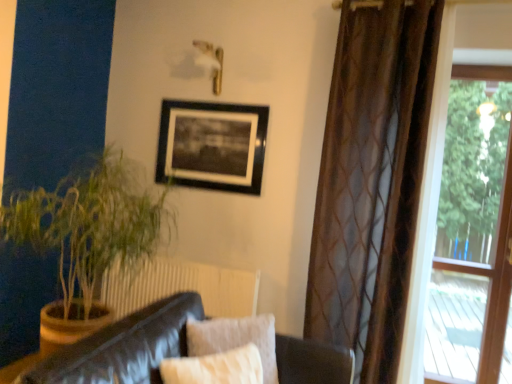
Describe the element at coordinates (212, 145) in the screenshot. I see `black matte picture frame at upper center` at that location.

What is the approximate width of transparent glass window at right?

transparent glass window at right is 2.80 inches wide.

Locate an element on the screen. green leafy plant at left is located at coordinates (89, 224).

At what (x,y) coordinates should I click in order to perform the action: click on leather couch at lower left. Please return your answer as a coordinate pair (x, y). Image resolution: width=512 pixels, height=384 pixels. Looking at the image, I should click on (124, 347).

From the picture: From the image's perspective, who appears lower, black matte picture frame at upper center or brown sheer curtain at right?

brown sheer curtain at right is shown below in the image.

Does black matte picture frame at upper center have a larger size compared to brown sheer curtain at right?

No.

Is black matte picture frame at upper center directly adjacent to brown sheer curtain at right?

black matte picture frame at upper center and brown sheer curtain at right are not in contact.

Considering the sizes of objects black matte picture frame at upper center and brown sheer curtain at right in the image provided, who is thinner, black matte picture frame at upper center or brown sheer curtain at right?

black matte picture frame at upper center.

Is point (111, 231) less distant than point (337, 381)?

No, (111, 231) is further to viewer.

From a real-world perspective, which is physically below, green leafy plant at left or leather couch at lower left?

leather couch at lower left is physically lower.

Is green leafy plant at left bigger or smaller than leather couch at lower left?

Clearly, green leafy plant at left is larger in size than leather couch at lower left.

Is point (393, 28) less distant than point (167, 302)?

No, (393, 28) is further to viewer.

Does brown sheer curtain at right turn towards leather couch at lower left?

Yes, brown sheer curtain at right faces towards leather couch at lower left.

How different are the orientations of brown sheer curtain at right and leather couch at lower left in degrees?

brown sheer curtain at right and leather couch at lower left are facing 90.9 degrees away from each other.

Looking at this image, from the image's perspective, is brown sheer curtain at right above or below leather couch at lower left?

brown sheer curtain at right is situated higher than leather couch at lower left in the image.

Based on the photo, is there a large distance between leather couch at lower left and black matte picture frame at upper center?

Indeed, leather couch at lower left is not near black matte picture frame at upper center.

Between leather couch at lower left and black matte picture frame at upper center, which one has larger size?

leather couch at lower left.

From the image's perspective, is leather couch at lower left located beneath black matte picture frame at upper center?

Yes, from the image's perspective, leather couch at lower left is below black matte picture frame at upper center.

Which of these two, leather couch at lower left or black matte picture frame at upper center, is thinner?

With smaller width is black matte picture frame at upper center.

Is transparent glass window at right to the left or to the right of black matte picture frame at upper center in the image?

Based on their positions, transparent glass window at right is located to the right of black matte picture frame at upper center.

Measure the distance between transparent glass window at right and black matte picture frame at upper center.

transparent glass window at right and black matte picture frame at upper center are 7.72 feet apart from each other.

How many degrees apart are the facing directions of transparent glass window at right and black matte picture frame at upper center?

The angular difference between transparent glass window at right and black matte picture frame at upper center is 0.306 degrees.

Is point (467, 225) closer or farther from the camera than point (233, 122)?

Clearly, point (467, 225) is more distant from the camera than point (233, 122).

Is black matte picture frame at upper center oriented towards transparent glass window at right?

No, black matte picture frame at upper center is not aimed at transparent glass window at right.

Considering the relative sizes of black matte picture frame at upper center and transparent glass window at right in the image provided, is black matte picture frame at upper center shorter than transparent glass window at right?

Correct, black matte picture frame at upper center is not as tall as transparent glass window at right.

Which of these two, black matte picture frame at upper center or transparent glass window at right, is wider?

transparent glass window at right is wider.

Is black matte picture frame at upper center outside of transparent glass window at right?

Absolutely, black matte picture frame at upper center is external to transparent glass window at right.

From the picture: Does leather couch at lower left have a lesser width compared to green leafy plant at left?

No.

Based on their sizes in the image, would you say leather couch at lower left is bigger or smaller than green leafy plant at left?

Clearly, leather couch at lower left is smaller in size than green leafy plant at left.

From the image's perspective, which object appears higher, leather couch at lower left or green leafy plant at left?

green leafy plant at left, from the image's perspective.

Are leather couch at lower left and green leafy plant at left making contact?

There is a gap between leather couch at lower left and green leafy plant at left.

At what (x,y) coordinates should I click in order to perform the action: click on curtain located below the black matte picture frame at upper center (from the image's perspective). Please return your answer as a coordinate pair (x, y). Looking at the image, I should click on (372, 180).

This screenshot has width=512, height=384. In the image, there is a leather couch at lower left. Find the location of `houseplant above it (from the image's perspective)`. houseplant above it (from the image's perspective) is located at coordinates (89, 224).

Looking at the image, which one is located further to brown sheer curtain at right, transparent glass window at right or green leafy plant at left?

Based on the image, transparent glass window at right appears to be further to brown sheer curtain at right.

Consider the image. Looking at the image, which one is located further to brown sheer curtain at right, transparent glass window at right or leather couch at lower left?

Based on the image, transparent glass window at right appears to be further to brown sheer curtain at right.

Considering their positions, is brown sheer curtain at right positioned further to green leafy plant at left than black matte picture frame at upper center?

brown sheer curtain at right lies further to green leafy plant at left than the other object.

Based on their spatial positions, is green leafy plant at left or black matte picture frame at upper center closer to leather couch at lower left?

green leafy plant at left is closer to leather couch at lower left.

Estimate the real-world distances between objects in this image. Which object is closer to leather couch at lower left, brown sheer curtain at right or transparent glass window at right?

brown sheer curtain at right is closer to leather couch at lower left.

Estimate the real-world distances between objects in this image. Which object is further from transparent glass window at right, brown sheer curtain at right or leather couch at lower left?

leather couch at lower left lies further to transparent glass window at right than the other object.

Considering their positions, is brown sheer curtain at right positioned further to transparent glass window at right than black matte picture frame at upper center?

black matte picture frame at upper center is positioned further to the anchor transparent glass window at right.

Based on their spatial positions, is leather couch at lower left or transparent glass window at right closer to green leafy plant at left?

leather couch at lower left is closer to green leafy plant at left.

Find the location of a particular element. The image size is (512, 384). houseplant between leather couch at lower left and black matte picture frame at upper center along the z-axis is located at coordinates (89, 224).

You are a GUI agent. You are given a task and a screenshot of the screen. Output one action in this format:
    pyautogui.click(x=<x>, y=<y>)
    Task: Click on the studio couch between green leafy plant at left and transparent glass window at right from left to right
    This screenshot has height=384, width=512.
    Given the screenshot: What is the action you would take?
    pyautogui.click(x=124, y=347)

Find the location of a particular element. picture frame between green leafy plant at left and transparent glass window at right is located at coordinates (212, 145).

The width and height of the screenshot is (512, 384). Identify the location of window between leather couch at lower left and black matte picture frame at upper center in the front-back direction. (473, 231).